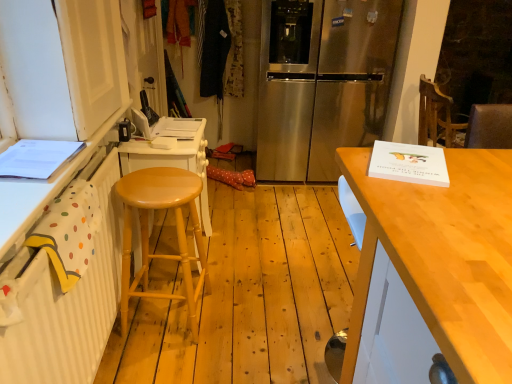
What do you see at coordinates (62, 65) in the screenshot? I see `white painted wood cabinet at left` at bounding box center [62, 65].

The width and height of the screenshot is (512, 384). Find the location of `stainless steel refrigerator at center`. stainless steel refrigerator at center is located at coordinates pyautogui.click(x=322, y=82).

Is light wood table at right shorter than stainless steel refrigerator at center?

Indeed, light wood table at right has a lesser height compared to stainless steel refrigerator at center.

Is light wood table at right located outside stainless steel refrigerator at center?

Yes, light wood table at right is not within stainless steel refrigerator at center.

How different are the orientations of light wood table at right and stainless steel refrigerator at center in degrees?

They differ by 2.22 degrees in their facing directions.

Does light wood table at right have a lesser width compared to stainless steel refrigerator at center?

Correct, the width of light wood table at right is less than that of stainless steel refrigerator at center.

Do you think light wood stool at left is within light wood table at right, or outside of it?

light wood stool at left cannot be found inside light wood table at right.

Find the location of a particular element. This screenshot has height=384, width=512. stool that is on the left side of light wood table at right is located at coordinates (148, 233).

From the image's perspective, relative to light wood table at right, is light wood stool at left above or below?

light wood stool at left is situated higher than light wood table at right in the image.

Does point (437, 220) come closer to viewer compared to point (45, 67)?

Yes, it is.

Considering the relative positions of light wood table at right and white painted wood cabinet at left in the image provided, is light wood table at right to the left of white painted wood cabinet at left from the viewer's perspective?

No.

In the image, is light wood table at right positioned in front of or behind white painted wood cabinet at left?

light wood table at right is behind white painted wood cabinet at left.

Measure the distance from light wood table at right to white painted wood cabinet at left.

The distance of light wood table at right from white painted wood cabinet at left is 3.59 feet.

Which is closer to the camera, [19,53] or [298,40]?

The point [19,53] is closer to the camera.

How different are the orientations of white painted wood cabinet at left and stainless steel refrigerator at center in degrees?

The facing directions of white painted wood cabinet at left and stainless steel refrigerator at center are 89.9 degrees apart.

Is white painted wood cabinet at left to the left or to the right of stainless steel refrigerator at center in the image?

In the image, white painted wood cabinet at left appears on the left side of stainless steel refrigerator at center.

Based on the photo, between white painted wood cabinet at left and stainless steel refrigerator at center, which one is positioned in front?

Positioned in front is white painted wood cabinet at left.

Considering the relative sizes of white painted wood cabinet at left and light wood table at right in the image provided, is white painted wood cabinet at left wider than light wood table at right?

Incorrect, the width of white painted wood cabinet at left does not surpass that of light wood table at right.

Is white painted wood cabinet at left closer to the viewer compared to light wood table at right?

Yes, white painted wood cabinet at left is closer to the camera.

Which of these two, white painted wood cabinet at left or light wood table at right, stands shorter?

With less height is white painted wood cabinet at left.

Could you tell me if stainless steel refrigerator at center is facing white painted wood cabinet at left?

No, stainless steel refrigerator at center is not turned towards white painted wood cabinet at left.

From a real-world perspective, is stainless steel refrigerator at center located beneath white painted wood cabinet at left?

Yes, from a real-world perspective, stainless steel refrigerator at center is beneath white painted wood cabinet at left.

In the scene shown: Which of these two, stainless steel refrigerator at center or white painted wood cabinet at left, stands taller?

stainless steel refrigerator at center.

Considering the relative positions of stainless steel refrigerator at center and light wood stool at left in the image provided, is stainless steel refrigerator at center to the right of light wood stool at left from the viewer's perspective?

Indeed, stainless steel refrigerator at center is positioned on the right side of light wood stool at left.

Is stainless steel refrigerator at center not close to light wood stool at left?

Yes, stainless steel refrigerator at center and light wood stool at left are located far from each other.

Which object is closer to the camera, stainless steel refrigerator at center or light wood stool at left?

light wood stool at left.

You are a GUI agent. You are given a task and a screenshot of the screen. Output one action in this format:
    pyautogui.click(x=<x>, y=<y>)
    Task: Click on the refrigerator that is above the light wood table at right (from the image's perspective)
    
    Given the screenshot: What is the action you would take?
    pyautogui.click(x=322, y=82)

The height and width of the screenshot is (384, 512). In order to click on desk on the right of the light wood stool at left in this screenshot , I will do `click(442, 255)`.

Based on their spatial positions, is stainless steel refrigerator at center or light wood stool at left closer to white painted wood cabinet at left?

light wood stool at left.

Looking at the image, which one is located closer to white painted wood cabinet at left, light wood table at right or stainless steel refrigerator at center?

The object closer to white painted wood cabinet at left is light wood table at right.

Based on their spatial positions, is white painted wood cabinet at left or light wood stool at left further from light wood table at right?

Among the two, white painted wood cabinet at left is located further to light wood table at right.

Consider the image. From the image, which object appears to be farther from stainless steel refrigerator at center, light wood table at right or white painted wood cabinet at left?

light wood table at right.

Which object lies further to the anchor point light wood table at right, light wood stool at left or stainless steel refrigerator at center?

The object further to light wood table at right is stainless steel refrigerator at center.

Estimate the real-world distances between objects in this image. Which object is further from stainless steel refrigerator at center, white painted wood cabinet at left or light wood stool at left?

white painted wood cabinet at left is further to stainless steel refrigerator at center.

Looking at this image, looking at the image, which one is located further to white painted wood cabinet at left, light wood table at right or light wood stool at left?

light wood table at right is positioned further to the anchor white painted wood cabinet at left.

Looking at the image, which one is located closer to light wood stool at left, light wood table at right or white painted wood cabinet at left?

Among the two, white painted wood cabinet at left is located nearer to light wood stool at left.

I want to click on stool positioned between light wood table at right and stainless steel refrigerator at center from near to far, so click(148, 233).

At what (x,y) coordinates should I click in order to perform the action: click on desk between white painted wood cabinet at left and stainless steel refrigerator at center in the front-back direction. Please return your answer as a coordinate pair (x, y). This screenshot has height=384, width=512. Looking at the image, I should click on pyautogui.click(x=442, y=255).

I want to click on stool located between white painted wood cabinet at left and light wood table at right in the left-right direction, so click(x=148, y=233).

Where is `stool located between white painted wood cabinet at left and stainless steel refrigerator at center in the depth direction`? Image resolution: width=512 pixels, height=384 pixels. stool located between white painted wood cabinet at left and stainless steel refrigerator at center in the depth direction is located at coordinates (148, 233).